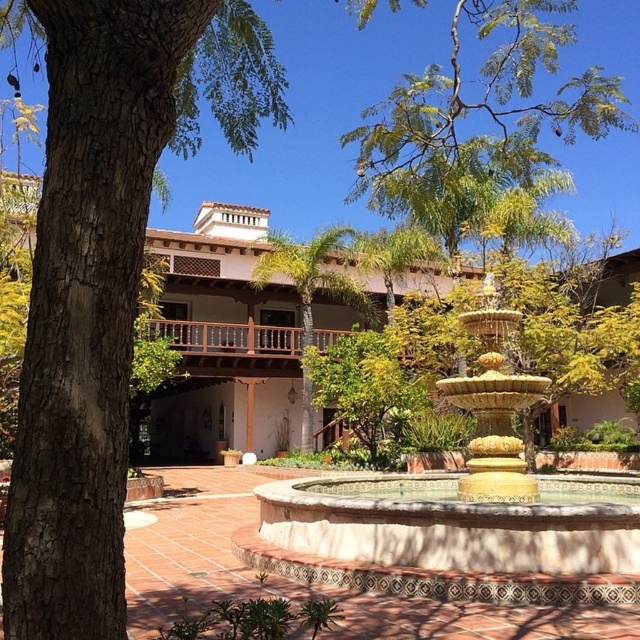
Describe the element at coordinates (460, 513) in the screenshot. I see `gold metallic fountain at center` at that location.

Who is positioned more to the right, gold metallic fountain at center or green leafy tree at center?

Positioned to the right is gold metallic fountain at center.

Locate an element on the screen. gold metallic fountain at center is located at coordinates (460, 513).

Locate an element on the screen. gold metallic fountain at center is located at coordinates (460, 513).